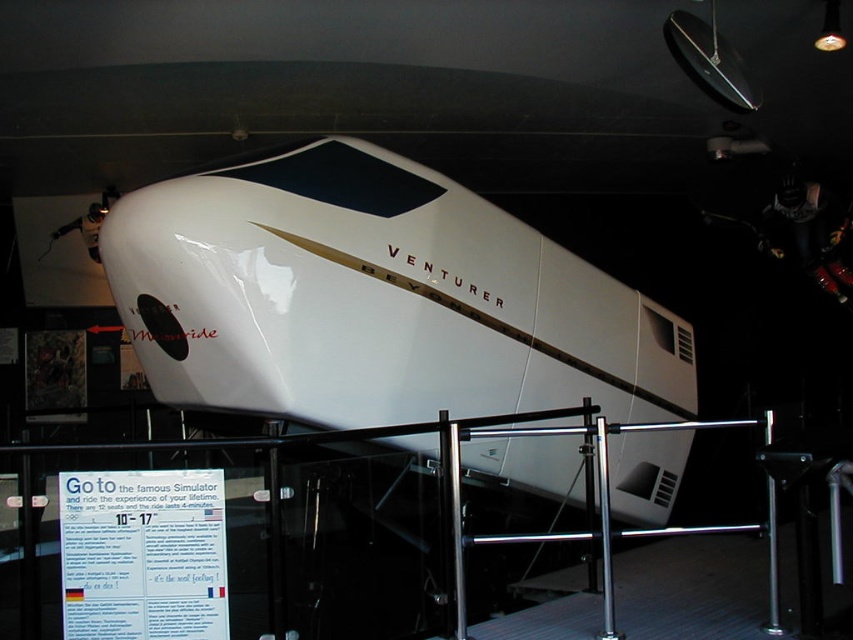
Can you confirm if white glossy bullet train at center is positioned to the right of polished metal railing at lower center?

Indeed, white glossy bullet train at center is positioned on the right side of polished metal railing at lower center.

Is point (347, 344) behind point (558, 428)?

Yes, point (347, 344) is farther from viewer.

What do you see at coordinates (375, 298) in the screenshot? The width and height of the screenshot is (853, 640). I see `white glossy bullet train at center` at bounding box center [375, 298].

Locate an element on the screen. Image resolution: width=853 pixels, height=640 pixels. white glossy bullet train at center is located at coordinates (375, 298).